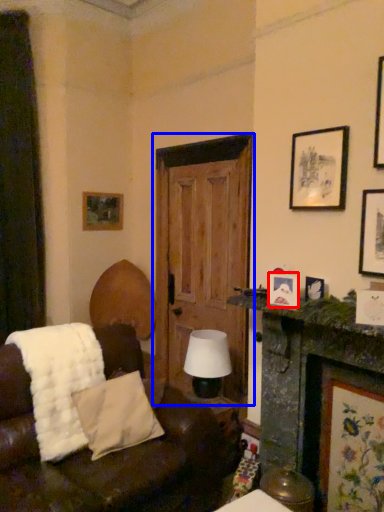
Question: Which of the following is the farthest to the observer, picture frame (highlighted by a red box) or door (highlighted by a blue box)?

Choices:
 (A) picture frame
 (B) door

Answer: (B)